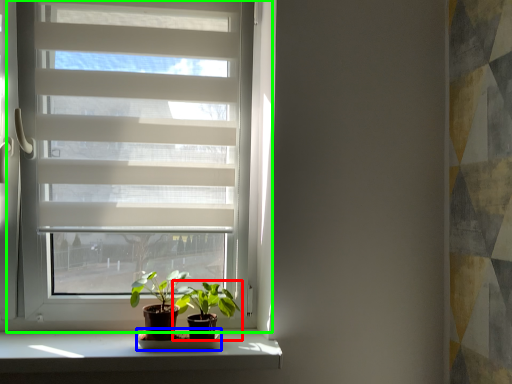
Question: Which object is the closest to the houseplant (highlighted by a red box)? Choose among these: shelf (highlighted by a blue box) or window (highlighted by a green box).

Choices:
 (A) shelf
 (B) window

Answer: (A)